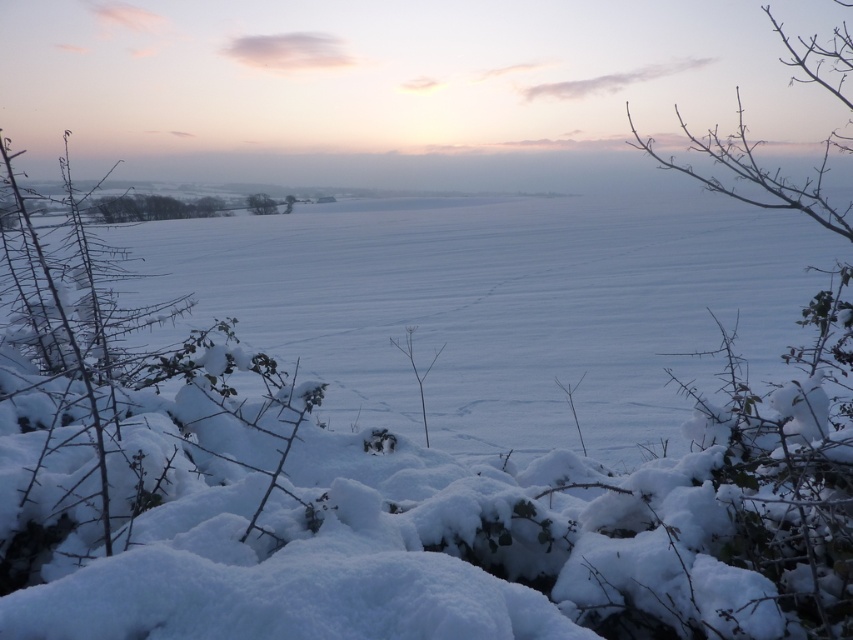
You are standing in the winter landscape and notice a point marked at coordinates (154, 208). Based on the scene description, where is this point located?

The point at (154, 208) is located on green leafy trees at upper left.

You are an observer standing in the winter landscape. You notice the green leafy trees at upper left and the green leafy tree at center. Which of these trees is taller?

The green leafy tree at center is taller than the green leafy trees at upper left.